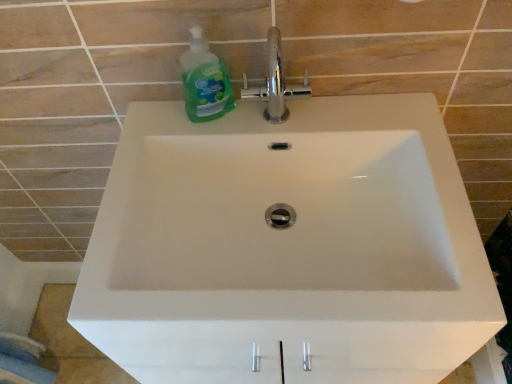
In order to click on green translucent liquid soap at upper left in this screenshot , I will do `click(205, 81)`.

The width and height of the screenshot is (512, 384). Describe the element at coordinates (205, 81) in the screenshot. I see `green translucent liquid soap at upper left` at that location.

The width and height of the screenshot is (512, 384). I want to click on chrome metallic faucet at upper center, so click(x=275, y=83).

This screenshot has width=512, height=384. What do you see at coordinates (275, 83) in the screenshot?
I see `chrome metallic faucet at upper center` at bounding box center [275, 83].

Locate an element on the screen. This screenshot has width=512, height=384. green translucent liquid soap at upper left is located at coordinates (205, 81).

Considering the relative positions of chrome metallic faucet at upper center and green translucent liquid soap at upper left in the image provided, is chrome metallic faucet at upper center to the left or to the right of green translucent liquid soap at upper left?

Based on their positions, chrome metallic faucet at upper center is located to the right of green translucent liquid soap at upper left.

Considering the relative positions of chrome metallic faucet at upper center and green translucent liquid soap at upper left in the image provided, is chrome metallic faucet at upper center behind green translucent liquid soap at upper left?

Yes.

Which point is more forward, (281, 116) or (206, 101)?

The point (206, 101) is in front.

In the scene shown: From the image's perspective, which is above, chrome metallic faucet at upper center or green translucent liquid soap at upper left?

chrome metallic faucet at upper center appears higher in the image.

From a real-world perspective, is chrome metallic faucet at upper center beneath green translucent liquid soap at upper left?

Incorrect, from a real-world perspective, chrome metallic faucet at upper center is higher than green translucent liquid soap at upper left.

Is chrome metallic faucet at upper center wider or thinner than green translucent liquid soap at upper left?

Considering their sizes, chrome metallic faucet at upper center looks slimmer than green translucent liquid soap at upper left.

In terms of height, does chrome metallic faucet at upper center look taller or shorter compared to green translucent liquid soap at upper left?

In the image, chrome metallic faucet at upper center appears to be taller than green translucent liquid soap at upper left.

Looking at the image, does chrome metallic faucet at upper center seem bigger or smaller compared to green translucent liquid soap at upper left?

chrome metallic faucet at upper center is smaller than green translucent liquid soap at upper left.

Is green translucent liquid soap at upper left inside chrome metallic faucet at upper center?

That's incorrect, green translucent liquid soap at upper left is not inside chrome metallic faucet at upper center.

Are chrome metallic faucet at upper center and green translucent liquid soap at upper left located far from each other?

chrome metallic faucet at upper center is actually quite close to green translucent liquid soap at upper left.

From the picture: Is chrome metallic faucet at upper center facing away from green translucent liquid soap at upper left?

No, chrome metallic faucet at upper center is not facing the opposite direction of green translucent liquid soap at upper left.

Locate an element on the screen. The width and height of the screenshot is (512, 384). cleaning product below the chrome metallic faucet at upper center (from a real-world perspective) is located at coordinates (205, 81).

Looking at this image, does green translucent liquid soap at upper left appear on the left side of chrome metallic faucet at upper center?

Indeed, green translucent liquid soap at upper left is positioned on the left side of chrome metallic faucet at upper center.

In the scene shown: In the image, is green translucent liquid soap at upper left positioned in front of or behind chrome metallic faucet at upper center?

Clearly, green translucent liquid soap at upper left is in front of chrome metallic faucet at upper center.

Is point (193, 75) farther from viewer compared to point (285, 119)?

No.

In the scene shown: From the image's perspective, would you say green translucent liquid soap at upper left is positioned over chrome metallic faucet at upper center?

No.

From a real-world perspective, is green translucent liquid soap at upper left on top of chrome metallic faucet at upper center?

Actually, green translucent liquid soap at upper left is physically below chrome metallic faucet at upper center in the real world.

Does green translucent liquid soap at upper left have a lesser width compared to chrome metallic faucet at upper center?

No, green translucent liquid soap at upper left is not thinner than chrome metallic faucet at upper center.

Does green translucent liquid soap at upper left have a lesser height compared to chrome metallic faucet at upper center?

Indeed, green translucent liquid soap at upper left has a lesser height compared to chrome metallic faucet at upper center.

Which of these two, green translucent liquid soap at upper left or chrome metallic faucet at upper center, is bigger?

Bigger between the two is green translucent liquid soap at upper left.

Is chrome metallic faucet at upper center a part of green translucent liquid soap at upper left?

No, green translucent liquid soap at upper left does not contain chrome metallic faucet at upper center.

Would you say green translucent liquid soap at upper left is a long distance from chrome metallic faucet at upper center?

No, green translucent liquid soap at upper left is not far from chrome metallic faucet at upper center.

Is green translucent liquid soap at upper left facing away from chrome metallic faucet at upper center?

That's not correct — green translucent liquid soap at upper left is not looking away from chrome metallic faucet at upper center.

Measure the distance from green translucent liquid soap at upper left to chrome metallic faucet at upper center.

3.40 inches.

At what (x,y) coordinates should I click in order to perform the action: click on tap on the right of green translucent liquid soap at upper left. Please return your answer as a coordinate pair (x, y). This screenshot has height=384, width=512. Looking at the image, I should click on (275, 83).

Find the location of a particular element. tap lying on the right of green translucent liquid soap at upper left is located at coordinates (275, 83).

The image size is (512, 384). In the image, there is a green translucent liquid soap at upper left. Identify the location of tap above it (from the image's perspective). (275, 83).